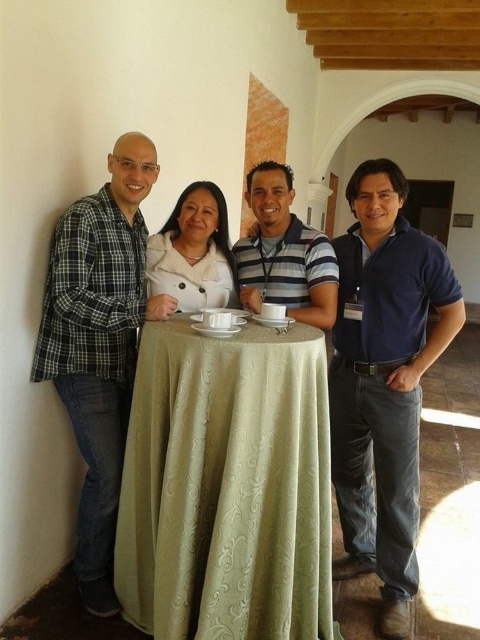
Question: Is green plaid shirt at left thinner than matte white shirt at center?

Choices:
 (A) no
 (B) yes

Answer: (B)

Question: Is green plaid shirt at left to the left of striped cotton shirt at center from the viewer's perspective?

Choices:
 (A) no
 (B) yes

Answer: (B)

Question: Does green textured tablecloth at center appear on the left side of blue cotton shirt at right?

Choices:
 (A) yes
 (B) no

Answer: (A)

Question: Which point appears farthest from the camera in this image?

Choices:
 (A) (396, 493)
 (B) (269, 401)
 (C) (106, 529)
 (D) (178, 273)

Answer: (D)

Question: Which is nearer to the blue cotton shirt at right?

Choices:
 (A) white textured sweater at center
 (B) green plaid shirt at left

Answer: (A)

Question: Which object is farther from the camera taking this photo?

Choices:
 (A) striped cotton shirt at center
 (B) matte white shirt at center
 (C) green plaid shirt at left

Answer: (A)